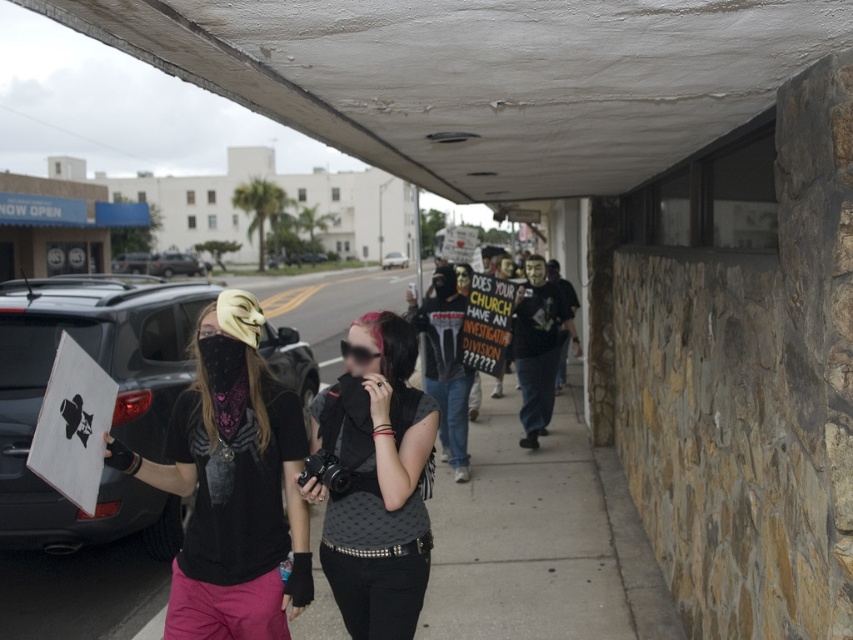
Does point (3, 378) lie in front of point (370, 536)?

No, (3, 378) is behind (370, 536).

Can you confirm if black matte car at left is bigger than matte black camera at center?

Correct, black matte car at left is larger in size than matte black camera at center.

Locate an element on the screen. This screenshot has height=640, width=853. black matte car at left is located at coordinates (114, 403).

Can you confirm if concrete sidewalk at center is thinner than matte black camera at center?

No, concrete sidewalk at center is not thinner than matte black camera at center.

Is concrete sidewalk at center smaller than matte black camera at center?

Actually, concrete sidewalk at center might be larger than matte black camera at center.

Between point (460, 582) and point (386, 417), which one is positioned in front?

Point (386, 417) is more forward.

This screenshot has width=853, height=640. I want to click on concrete sidewalk at center, so click(x=541, y=538).

Between point (146, 358) and point (392, 262), which one is positioned behind?

The point (392, 262) is behind.

Which is more to the right, black matte car at left or silver metallic sedan at center?

From the viewer's perspective, silver metallic sedan at center appears more on the right side.

What are the coordinates of `black matte car at left` in the screenshot? It's located at (114, 403).